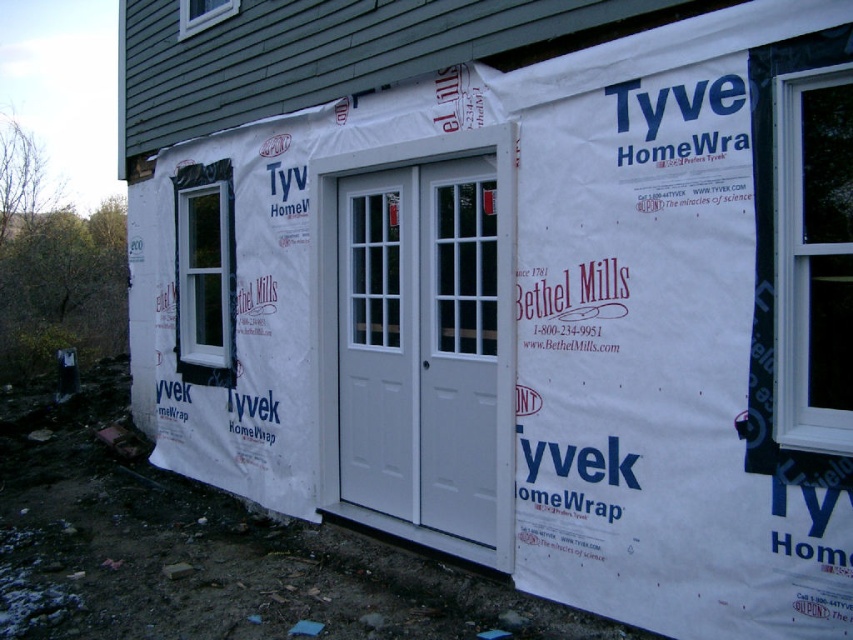
Between point (370, 492) and point (850, 348), which one is positioned in front?

Point (850, 348)

Does white painted wood screen door at center come in front of white plastic window at right?

No, it is behind white plastic window at right.

Is point (370, 292) farther from camera compared to point (791, 376)?

Yes, point (370, 292) is behind point (791, 376).

What are the coordinates of `white painted wood screen door at center` in the screenshot? It's located at (419, 340).

Between white painted wood screen door at center and white smooth window at left, which one has more height?

white painted wood screen door at center is taller.

Does white painted wood screen door at center have a smaller size compared to white smooth window at left?

No, white painted wood screen door at center is not smaller than white smooth window at left.

Who is more forward, (x=350, y=253) or (x=178, y=314)?

Point (x=350, y=253) is more forward.

Where is `white painted wood screen door at center`? white painted wood screen door at center is located at coordinates (419, 340).

Describe the element at coordinates (419, 340) in the screenshot. This screenshot has width=853, height=640. I see `white painted wood screen door at center` at that location.

Measure the distance between point (x=422, y=509) and camera.

5.25 meters

I want to click on white painted wood screen door at center, so click(419, 340).